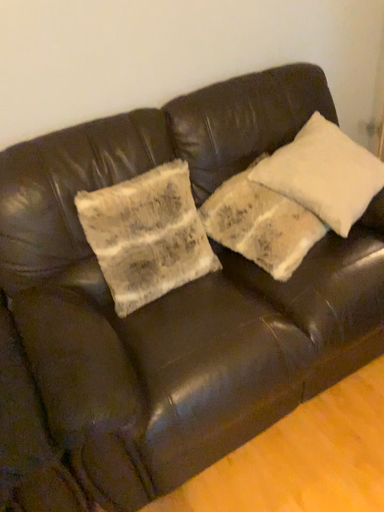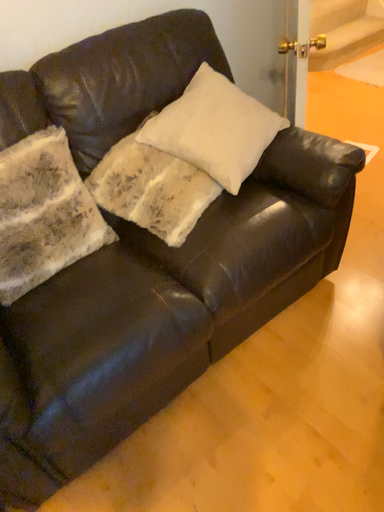
Question: How did the camera likely rotate when shooting the video?

Choices:
 (A) rotated right
 (B) rotated left

Answer: (A)